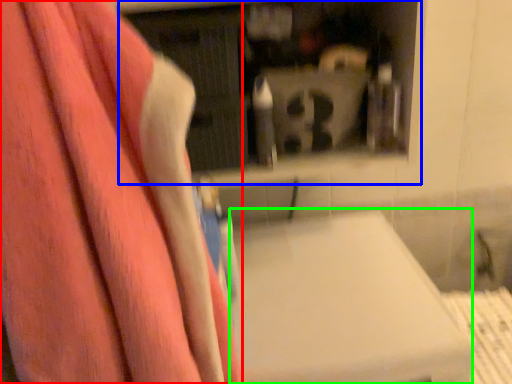
Question: Which is farther away from towel (highlighted by a red box)? shelf (highlighted by a blue box) or lift (highlighted by a green box)?

Choices:
 (A) shelf
 (B) lift

Answer: (A)